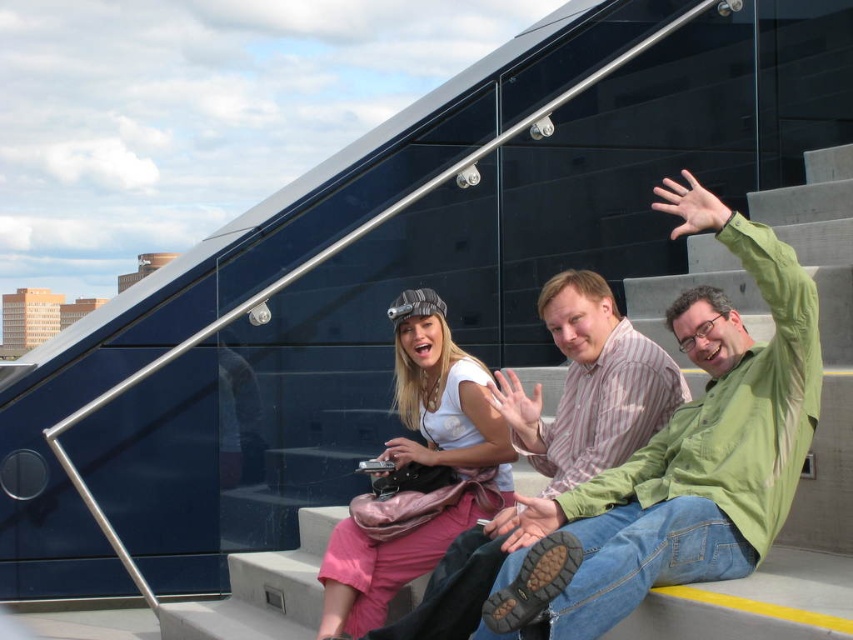
You are standing at the bottom of the staircase and see the white matte shirt at center and the striped cotton shirt at center. Which one is closer to you?

The white matte shirt at center is positioned under the striped cotton shirt at center, so the white matte shirt at center is closer to you.

From the picture: You are standing at the bottom of the staircase and see two people wearing shirts at the center. The green cotton shirt at center and the striped cotton shirt at center. Which shirt is higher up on the staircase?

The green cotton shirt at center is above the striped cotton shirt at center, so the green cotton shirt at center is higher up on the staircase.

You are standing on the staircase and want to hand a book to the person wearing the green cotton shirt at center and the white matte shirt at center. Which one can you reach first without moving your position?

The green cotton shirt at center is located above the white matte shirt at center, so you can reach the green cotton shirt at center first without moving your position.